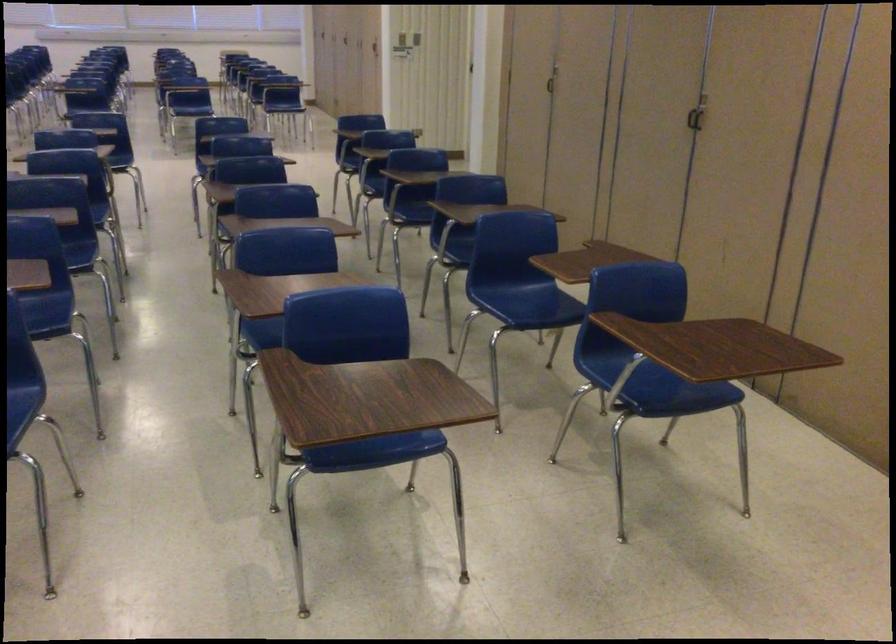
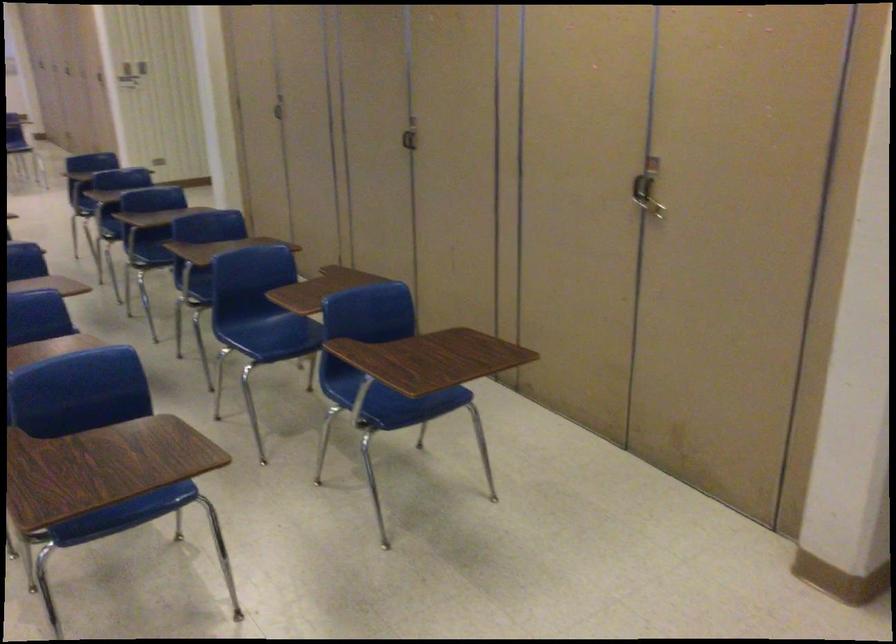
In the second image, find the point that corresponds to (x=383, y=451) in the first image.

(126, 516)